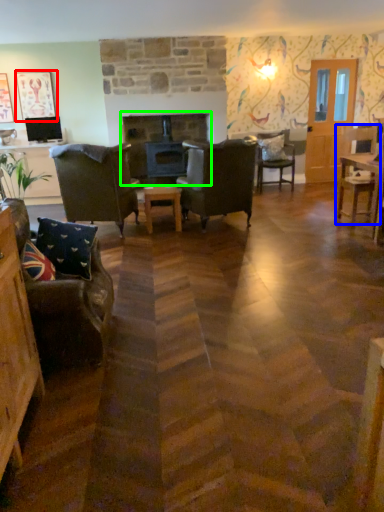
Question: Which is nearer to the picture frame (highlighted by a red box)? chair (highlighted by a blue box) or fireplace (highlighted by a green box).

Choices:
 (A) chair
 (B) fireplace

Answer: (B)